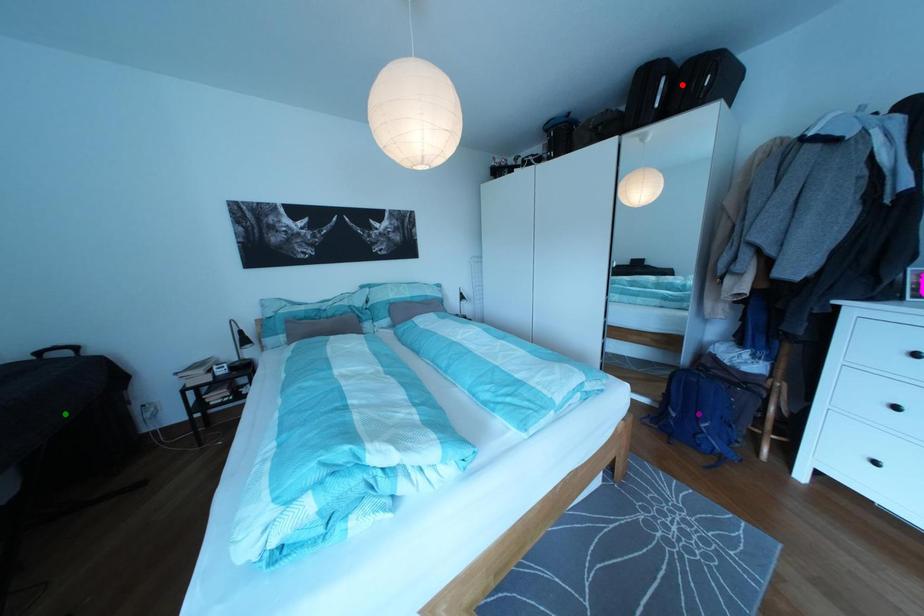
Order these from nearest to farthest:
purple point
green point
red point

green point → red point → purple point